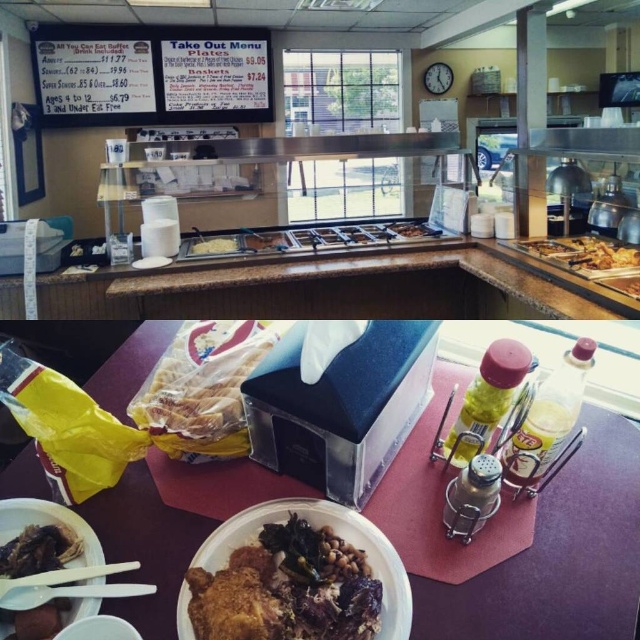
You are a customer at the restaurant and want to grab the golden crispy chicken at center. However, there is a white paper plate at center in the way. Can you reach the chicken without moving the plate?

The golden crispy chicken at center is closer to the viewer than the white paper plate at center, so you can reach the chicken without moving the plate.

You are a customer at the restaurant and want to place your takeout order. You see a white plastic plate at lower left and a white plastic chopstick at lower left. Which item is located more to the left?

The white plastic plate at lower left is positioned on the left side of white plastic chopstick at lower left, so the plate is more to the left.

You are a customer at the restaurant and want to place your takeout order. You see the brown granite counter at center and the white plastic plate at lower left. Which object is higher in height?

The brown granite counter at center is taller than the white plastic plate at lower left.